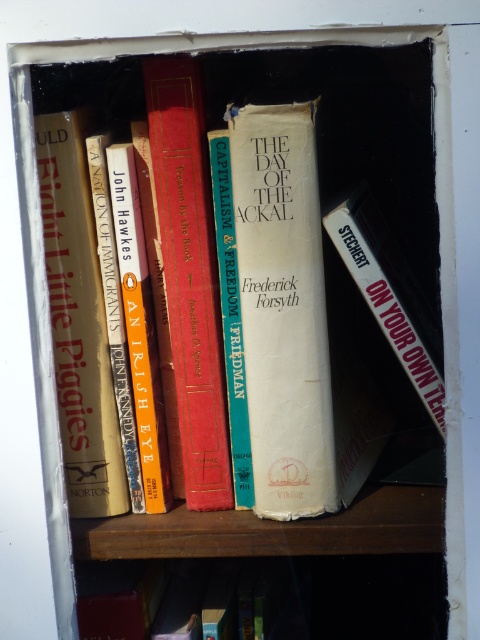
Which of these two, hardcover book at center or hardcover book at lower center, stands shorter?

With less height is hardcover book at lower center.

Who is more forward, (x=181, y=90) or (x=103, y=637)?

Point (x=181, y=90) is more forward.

In order to click on hardcover book at center in this screenshot , I will do `click(189, 276)`.

From the picture: Can you confirm if hardcover book at left is smaller than white matte book at right?

Yes, hardcover book at left is smaller than white matte book at right.

What do you see at coordinates (79, 321) in the screenshot?
I see `hardcover book at left` at bounding box center [79, 321].

Who is more distant from viewer, (87, 372) or (396, 344)?

The point (87, 372) is more distant.

Identify the location of hardcover book at left. (79, 321).

Between hardcover book at lower center and white matte book at right, which one has less height?

hardcover book at lower center is shorter.

Between hardcover book at lower center and white matte book at right, which one appears on the left side from the viewer's perspective?

hardcover book at lower center is more to the left.

Who is more forward, (x=140, y=605) or (x=396, y=324)?

Point (x=396, y=324) is in front.

At what (x,y) coordinates should I click in order to perform the action: click on hardcover book at lower center. Please return your answer as a coordinate pair (x, y). The height and width of the screenshot is (640, 480). Looking at the image, I should click on (139, 598).